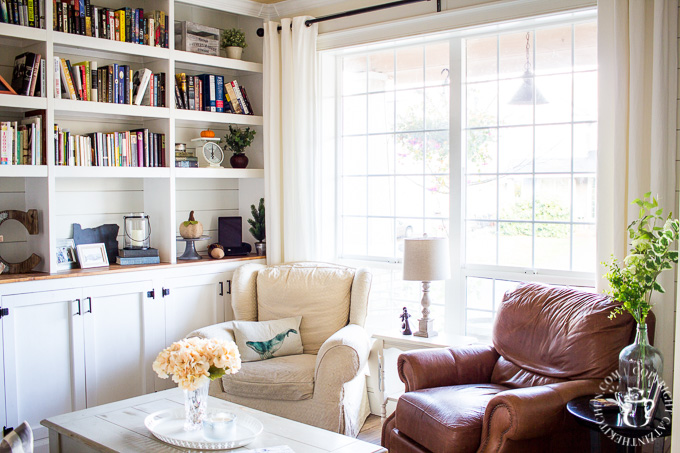
Identify the location of tan chair. This screenshot has height=453, width=680. (332, 301).